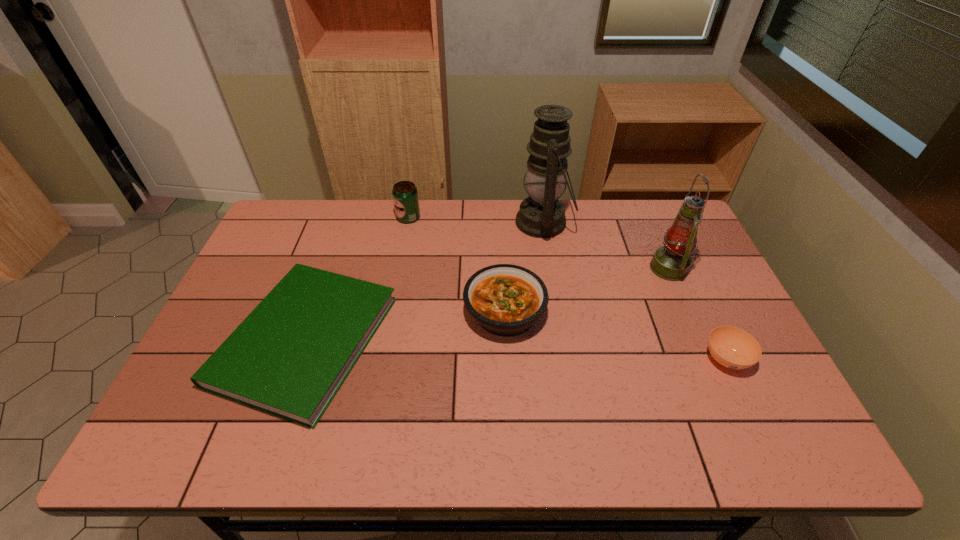
Locate an element on the screen. This screenshot has width=960, height=540. vacant space in between the right oil lamp and the tallest object is located at coordinates (606, 245).

You are a GUI agent. You are given a task and a screenshot of the screen. Output one action in this format:
    pyautogui.click(x=<x>, y=<y>)
    Task: Click on the empty space that is in between the third shortest object and the right oil lamp
    
    Given the screenshot: What is the action you would take?
    pyautogui.click(x=587, y=291)

Image resolution: width=960 pixels, height=540 pixels. I want to click on free point between the left oil lamp and the paperback book, so click(424, 281).

Find the location of a particular element. The width and height of the screenshot is (960, 540). vacant region between the third tallest object and the paperback book is located at coordinates (357, 279).

Where is `empty space that is in between the beer can and the right oil lamp`? empty space that is in between the beer can and the right oil lamp is located at coordinates (539, 243).

Locate an element on the screen. The width and height of the screenshot is (960, 540). vacant point located between the soup bowl and the fourth shortest object is located at coordinates (567, 288).

Locate an element on the screen. This screenshot has height=540, width=960. object that is the second closest to the third tallest object is located at coordinates [506, 300].

Choose which object is the second nearest neighbor to the third tallest object. Please provide its 2D coordinates. Your answer should be formatted as a tuple, i.e. [(x, y)], where the tuple contains the x and y coordinates of a point satisfying the conditions above.

[(506, 300)]

Where is `free region that satisfies the following two spatial constraints: 1. on the back side of the paperback book; 2. on the right side of the nearer oil lamp`? The height and width of the screenshot is (540, 960). free region that satisfies the following two spatial constraints: 1. on the back side of the paperback book; 2. on the right side of the nearer oil lamp is located at coordinates (330, 268).

This screenshot has width=960, height=540. What are the coordinates of `vacant region that satisfies the following two spatial constraints: 1. on the front side of the fifth shortest object; 2. on the left side of the second shortest object` in the screenshot? It's located at click(708, 359).